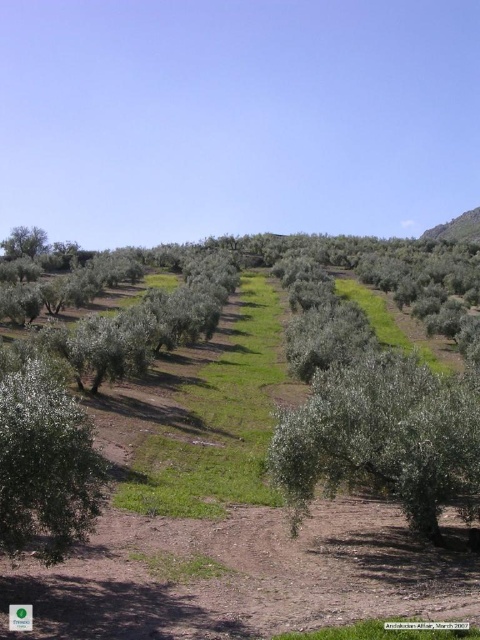
Describe the element at coordinates (46, 465) in the screenshot. I see `green leafy tree at lower left` at that location.

Does green leafy tree at lower left appear on the left side of green leafy tree at left?

No, green leafy tree at lower left is not to the left of green leafy tree at left.

This screenshot has width=480, height=640. What do you see at coordinates (46, 465) in the screenshot? I see `green leafy tree at lower left` at bounding box center [46, 465].

Locate an element on the screen. This screenshot has height=640, width=480. green leafy tree at lower left is located at coordinates (46, 465).

Is green leafy tree at center to the left of green leafy tree at lower left from the viewer's perspective?

No, green leafy tree at center is not to the left of green leafy tree at lower left.

Does point (336, 477) lie behind point (31, 541)?

Yes, point (336, 477) is behind point (31, 541).

Is point (314, 474) farther from viewer compared to point (27, 508)?

Yes, point (314, 474) is behind point (27, 508).

The image size is (480, 640). In order to click on green leafy tree at center in this screenshot , I will do `click(381, 438)`.

Is point (467, 442) less distant than point (20, 250)?

That is True.

Does green leafy tree at center have a smaller size compared to green leafy tree at left?

Indeed, green leafy tree at center has a smaller size compared to green leafy tree at left.

Where is `green leafy tree at center`? This screenshot has height=640, width=480. green leafy tree at center is located at coordinates (381, 438).

This screenshot has width=480, height=640. In order to click on green leafy tree at center in this screenshot , I will do `click(381, 438)`.